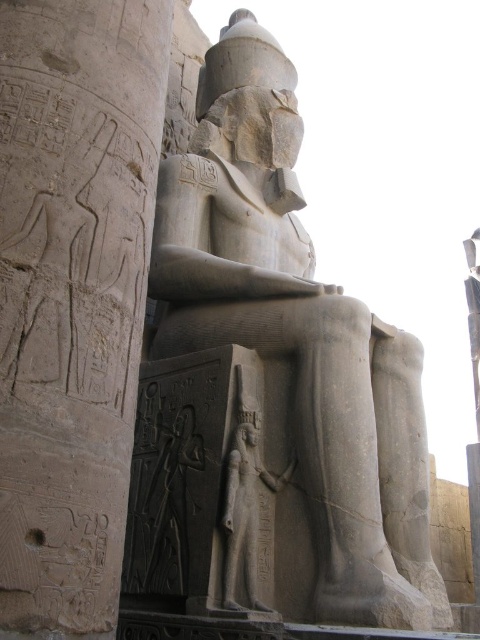
Which is behind, point (54, 56) or point (380, 438)?

The point (380, 438) is more distant.

Which of these two, gray stone hieroglyphics at center or gray stone statue at center, stands taller?

Standing taller between the two is gray stone statue at center.

Describe the element at coordinates (72, 296) in the screenshot. I see `gray stone hieroglyphics at center` at that location.

Where is `gray stone hieroglyphics at center`? gray stone hieroglyphics at center is located at coordinates (72, 296).